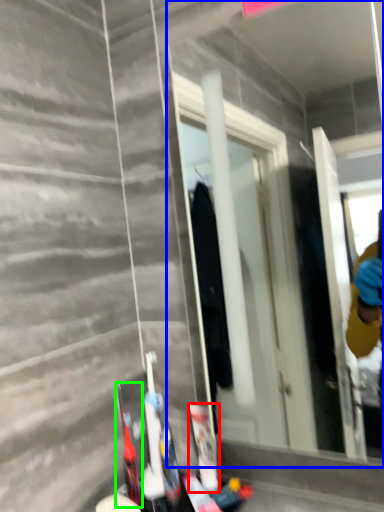
Question: Which is nearer to the toiletry (highlighted by a red box)? mirror (highlighted by a blue box) or toiletry (highlighted by a green box).

Choices:
 (A) mirror
 (B) toiletry

Answer: (B)